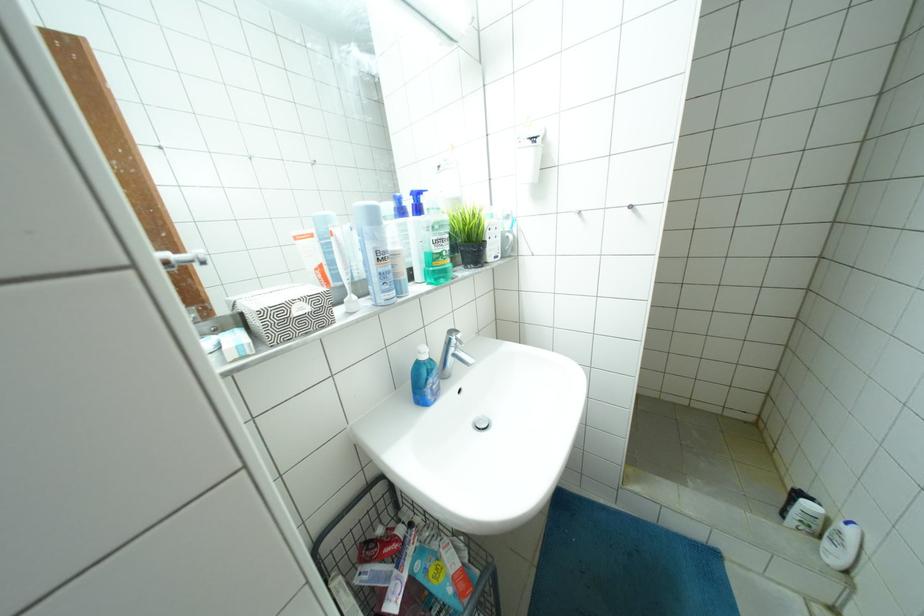
This screenshot has width=924, height=616. What do you see at coordinates (180, 257) in the screenshot?
I see `a metal cabinet handle` at bounding box center [180, 257].